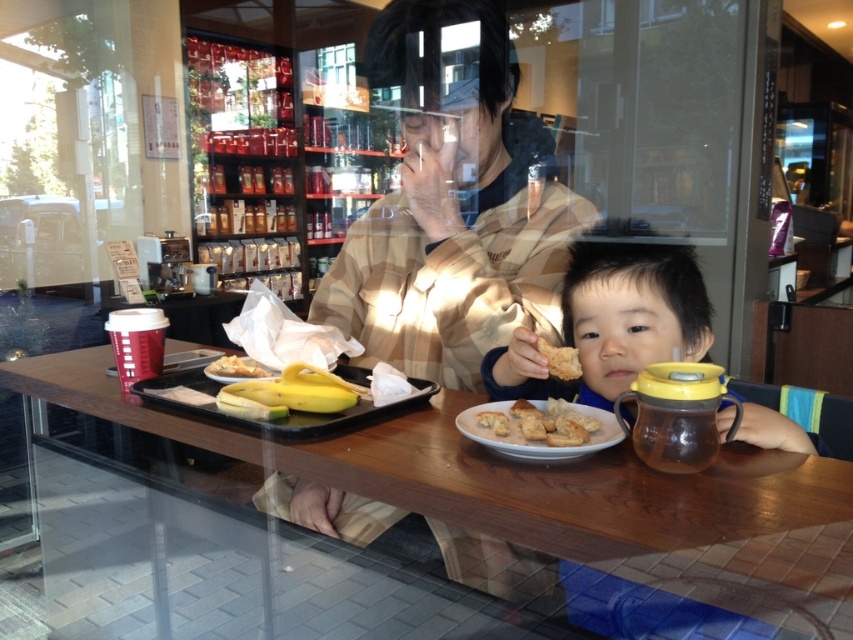
You are standing at the entrance of the cafe and want to sit at the wooden table at center. Which direction should you walk to reach it?

Since the wooden table at center is located at point [492,472], you should walk towards the center of the cafe to reach it.

You are a customer in the cafe and want to grab both the smooth brown hair at center and the golden brown croutons at center quickly. Can you reach both items without moving your hand more than 6 inches?

The distance between the smooth brown hair at center and the golden brown croutons at center is 5.98 inches, so yes, you can reach both items without moving your hand more than 6 inches.

You are a barista who needs to place both the smooth brown hair at center and the golden brown croutons at center on a shelf that can only hold items up to 10 cm in width. Which item should you place first to ensure both fit?

The smooth brown hair at center is wider than the golden brown croutons at center. To ensure both fit on the shelf, place the narrower item first, which is the golden brown croutons at center, followed by the wider one.